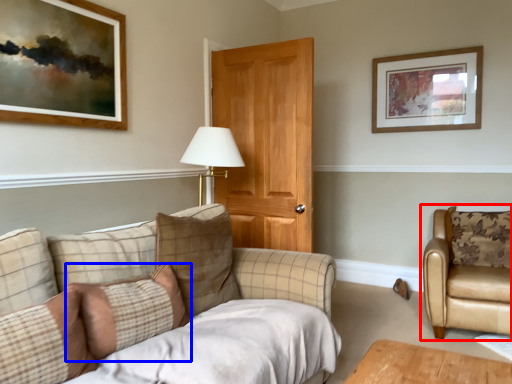
Question: Which point is closer to the camera, chair (highlighted by a red box) or pillow (highlighted by a blue box)?

Choices:
 (A) chair
 (B) pillow

Answer: (B)